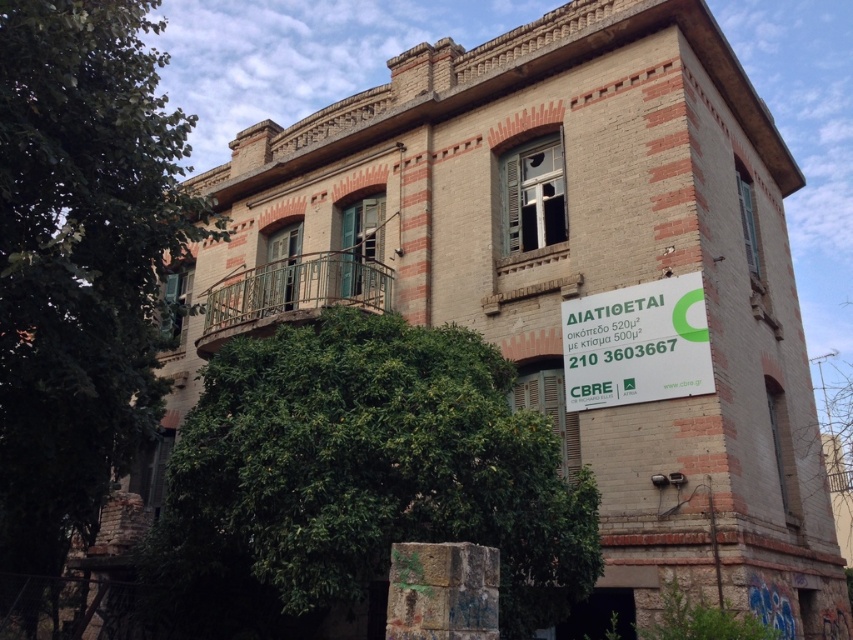
You are a visitor trying to read the green paper sign at center near the building. However, there is a green leafy tree at center blocking your view. From your perspective, which direction should you move to get a clearer view of the green paper sign?

The green leafy tree at center is to the left of the green paper sign at center. To get a clearer view of the green paper sign at center, you should move to the right side of the tree so it no longer blocks your view.

You are a visitor trying to read the green paper sign at center but the green leafy tree at center is blocking your view. Can you move around to see the sign clearly?

The green leafy tree at center is in front of the green paper sign at center, so moving to the side might allow you to see around the tree to view the sign clearly.

You are a delivery person trying to read the green paper sign at center. However, the green leafy tree at left is blocking your view. Can you estimate if the tree is tall enough to block the sign?

The green leafy tree at left is much taller than the green paper sign at center, so yes, the tree is tall enough to block the view of the sign.